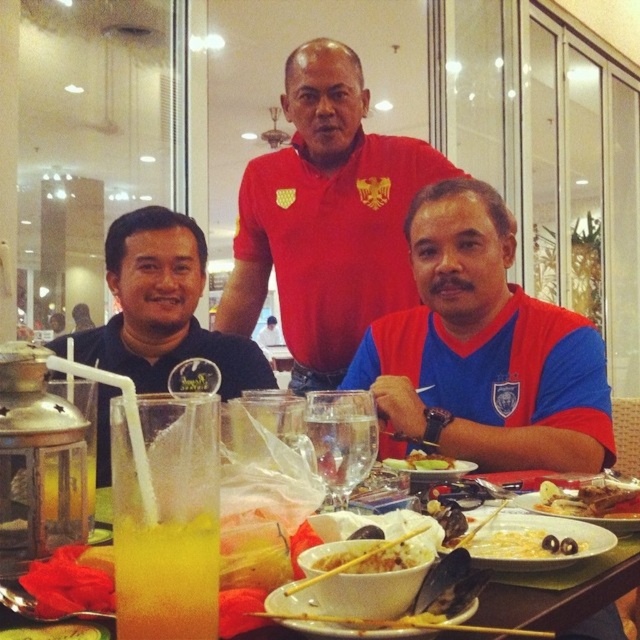
Who is taller, golden crispy chicken at lower right or yellowish matte rice at center?

golden crispy chicken at lower right

Can you confirm if golden crispy chicken at lower right is smaller than yellowish matte rice at center?

Incorrect, golden crispy chicken at lower right is not smaller in size than yellowish matte rice at center.

Does point (609, 483) come in front of point (394, 467)?

Yes, it is in front of point (394, 467).

In order to click on golden crispy chicken at lower right in this screenshot , I will do `click(589, 499)`.

Does blue/red jersey at center appear under clear glass water at center?

No, blue/red jersey at center is not below clear glass water at center.

Who is higher up, blue/red jersey at center or clear glass water at center?

blue/red jersey at center is above.

Is point (483, 358) positioned after point (316, 445)?

Yes, it is.

You are a GUI agent. You are given a task and a screenshot of the screen. Output one action in this format:
    pyautogui.click(x=<x>, y=<y>)
    Task: Click on the blue/red jersey at center
    This screenshot has height=640, width=640.
    Given the screenshot: What is the action you would take?
    pyautogui.click(x=483, y=349)

Looking at this image, can you confirm if blue/red jersey at center is positioned to the right of black matte shirt at left?

Yes, blue/red jersey at center is to the right of black matte shirt at left.

The height and width of the screenshot is (640, 640). Describe the element at coordinates (483, 349) in the screenshot. I see `blue/red jersey at center` at that location.

This screenshot has width=640, height=640. What are the coordinates of `blue/red jersey at center` in the screenshot? It's located at (483, 349).